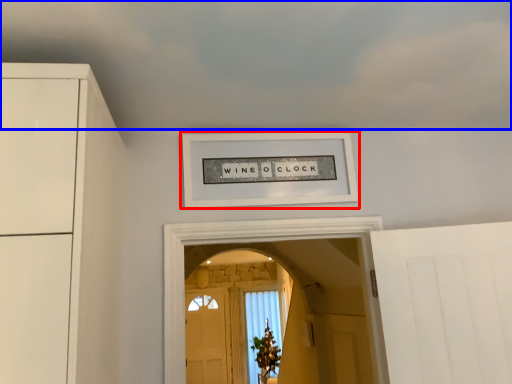
Question: Which object appears farthest to the camera in this image, picture frame (highlighted by a red box) or cloud (highlighted by a blue box)?

Choices:
 (A) picture frame
 (B) cloud

Answer: (A)